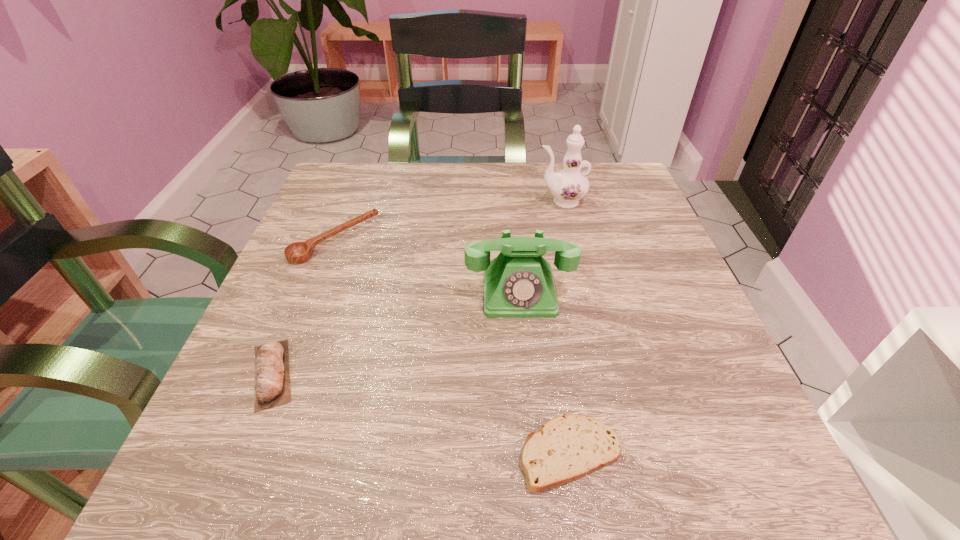
I want to click on free location located at the spout of the chinaware, so click(x=515, y=201).

Locate an element on the screen. This screenshot has height=540, width=960. vacant space located 0.280m at the spout of the chinaware is located at coordinates (414, 201).

You are a GUI agent. You are given a task and a screenshot of the screen. Output one action in this format:
    pyautogui.click(x=<x>, y=<y>)
    Task: Click on the vacant area situated 0.070m on the dial of the fourth shortest object
    The width and height of the screenshot is (960, 540).
    Given the screenshot: What is the action you would take?
    pyautogui.click(x=525, y=352)

This screenshot has width=960, height=540. Identify the location of free space located on the back of the fourth farthest object. (300, 308).

I want to click on blank space located on the back of the wooden spoon, so click(355, 189).

What are the coordinates of `vacant space positioned 0.060m on the back of the nearest object` in the screenshot? It's located at pos(559,380).

You are a GUI agent. You are given a task and a screenshot of the screen. Output one action in this format:
    pyautogui.click(x=<x>, y=<y>)
    Task: Click on the object located at the far edge
    This screenshot has height=540, width=960.
    Given the screenshot: What is the action you would take?
    pyautogui.click(x=568, y=186)

The height and width of the screenshot is (540, 960). In order to click on object that is at the near edge in this screenshot , I will do `click(567, 448)`.

The height and width of the screenshot is (540, 960). Identify the location of pita bread at the left edge. (272, 379).

Where is `wooden spoon that is at the left edge`? This screenshot has width=960, height=540. wooden spoon that is at the left edge is located at coordinates (298, 252).